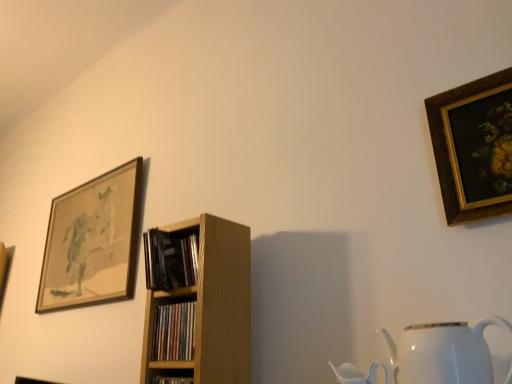
Question: From the image's perspective, is wooden bookshelf at center, acting as the first book starting from the bottom, located above or below wooden shelf at center?

Choices:
 (A) above
 (B) below

Answer: (A)

Question: Considering the positions of wooden bookshelf at center, acting as the first book starting from the bottom, and wooden shelf at center in the image, is wooden bookshelf at center, acting as the first book starting from the bottom, taller or shorter than wooden shelf at center?

Choices:
 (A) short
 (B) tall

Answer: (A)

Question: Estimate the real-world distances between objects in this image. Which object is farther from the wooden bookshelf at center, placed as the 1th book when sorted from top to bottom?

Choices:
 (A) wooden shelf at center
 (B) white glossy jug at lower right
 (C) gold-framed painting at upper right, which is the 2th picture frame in back-to-front order
 (D) wooden framed artwork at upper left, marked as the 2th picture frame in a front-to-back arrangement
 (E) wooden bookshelf at center, positioned as the second book in top-to-bottom order

Answer: (D)

Question: Estimate the real-world distances between objects in this image. Which object is closer to the wooden shelf at center?

Choices:
 (A) wooden bookshelf at center, placed as the 1th book when sorted from top to bottom
 (B) wooden bookshelf at center, acting as the first book starting from the bottom
 (C) gold-framed painting at upper right, which is the 2th picture frame in back-to-front order
 (D) white glossy jug at lower right
 (E) wooden framed artwork at upper left, the 1th picture frame from the left

Answer: (B)